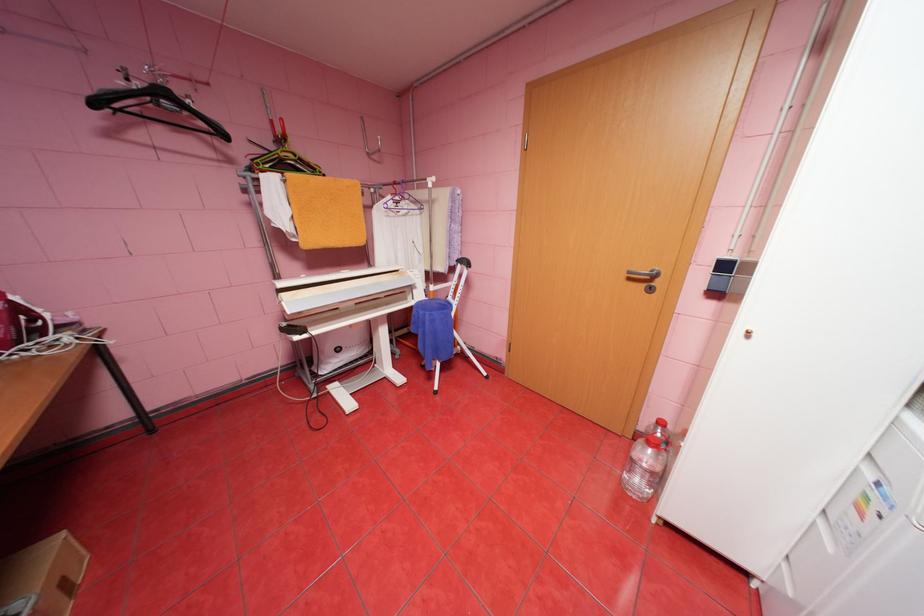
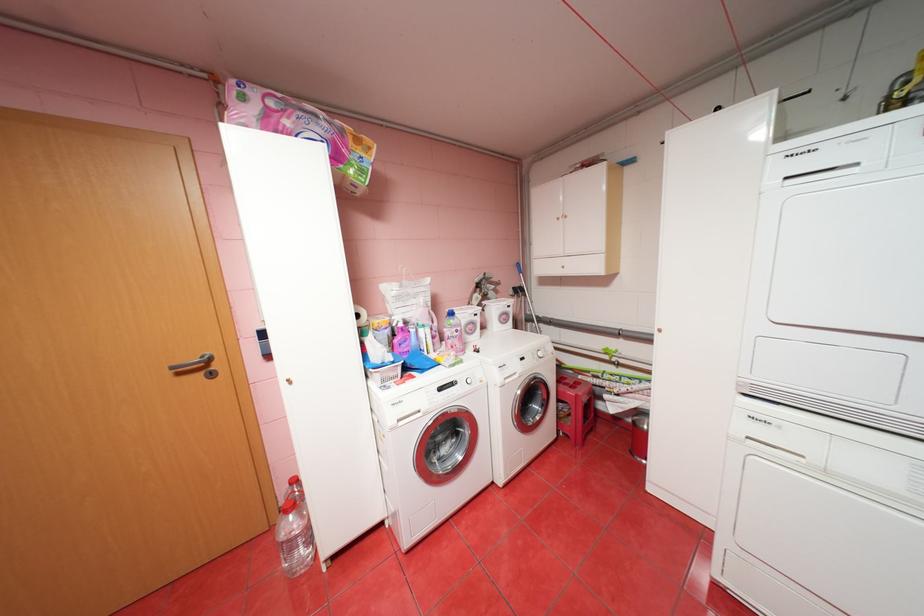
Question: The camera is either moving clockwise (left) or counter-clockwise (right) around the object. The first image is from the beginning of the video and the second image is from the end. Is the camera moving left or right when shooting the video?

Choices:
 (A) Left
 (B) Right

Answer: (A)